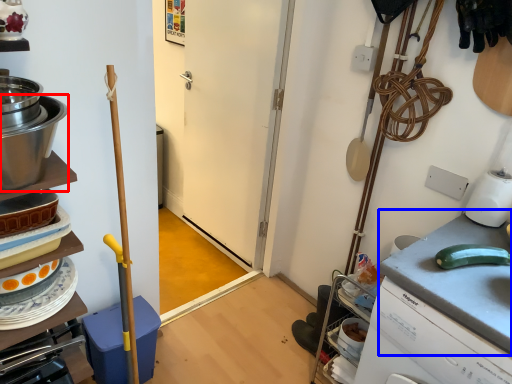
Question: Among these objects, which one is farthest to the camera, kitchen appliance (highlighted by a red box) or counter top (highlighted by a blue box)?

Choices:
 (A) kitchen appliance
 (B) counter top

Answer: (B)